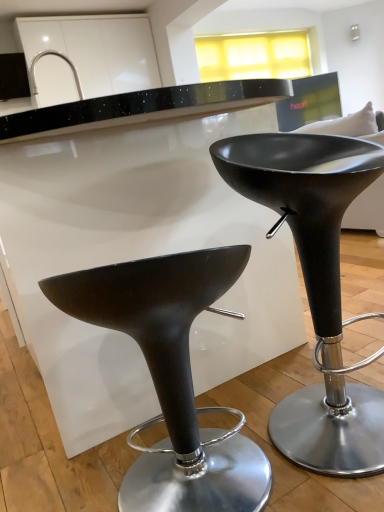
Question: From the image's perspective, relative to matte black stool at center, the 1th stool in the right-to-left sequence, is matte black stool at lower left, which ranks as the second stool in right-to-left order, above or below?

Choices:
 (A) below
 (B) above

Answer: (A)

Question: Is point (223, 247) positioned closer to the camera than point (306, 276)?

Choices:
 (A) farther
 (B) closer

Answer: (B)

Question: Which of these objects is positioned farthest from the satin nickel faucet at upper left?

Choices:
 (A) matte black stool at center, the 1th stool in the right-to-left sequence
 (B) matte black stool at lower left, which ranks as the second stool in right-to-left order

Answer: (B)

Question: Based on their relative distances, which object is nearer to the satin nickel faucet at upper left?

Choices:
 (A) matte black stool at center, the 1th stool in the right-to-left sequence
 (B) matte black stool at lower left, marked as the 1th stool in a left-to-right arrangement

Answer: (A)